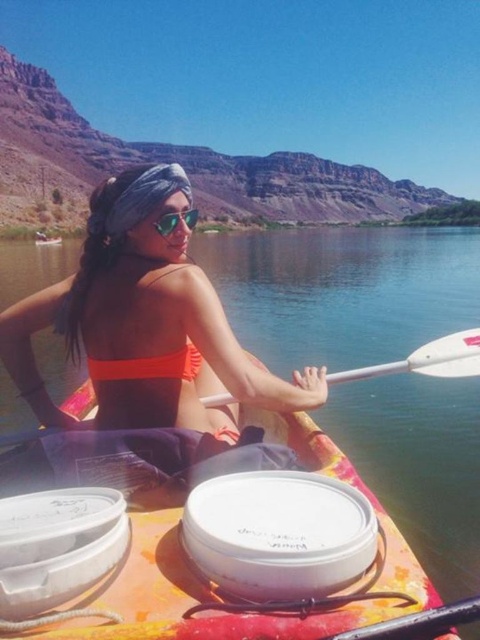
Is point (120, 380) positioned before point (50, 237)?

Yes.

Consider the image. Is matte red bikini top at center shorter than orange fabric boat at center?

Indeed, matte red bikini top at center has a lesser height compared to orange fabric boat at center.

Is point (181, 364) in front of point (60, 243)?

Yes, it is in front of point (60, 243).

Where is `matte red bikini top at center`? The image size is (480, 640). matte red bikini top at center is located at coordinates (148, 365).

Who is taller, clear water at center or orange bikini top at upper center?

clear water at center

Is point (420, 518) closer to camera compared to point (187, 384)?

No, it is behind (187, 384).

Which is in front, point (354, 355) or point (8, 330)?

Point (8, 330) is in front.

Where is `clear water at center`? The height and width of the screenshot is (640, 480). clear water at center is located at coordinates coord(344,289).

Is orange bikini top at upper center below white plastic paddle at center?

No.

This screenshot has width=480, height=640. Describe the element at coordinates (144, 323) in the screenshot. I see `orange bikini top at upper center` at that location.

This screenshot has width=480, height=640. What do you see at coordinates (144, 323) in the screenshot?
I see `orange bikini top at upper center` at bounding box center [144, 323].

Identify the location of orange bikini top at upper center. The image size is (480, 640). (144, 323).